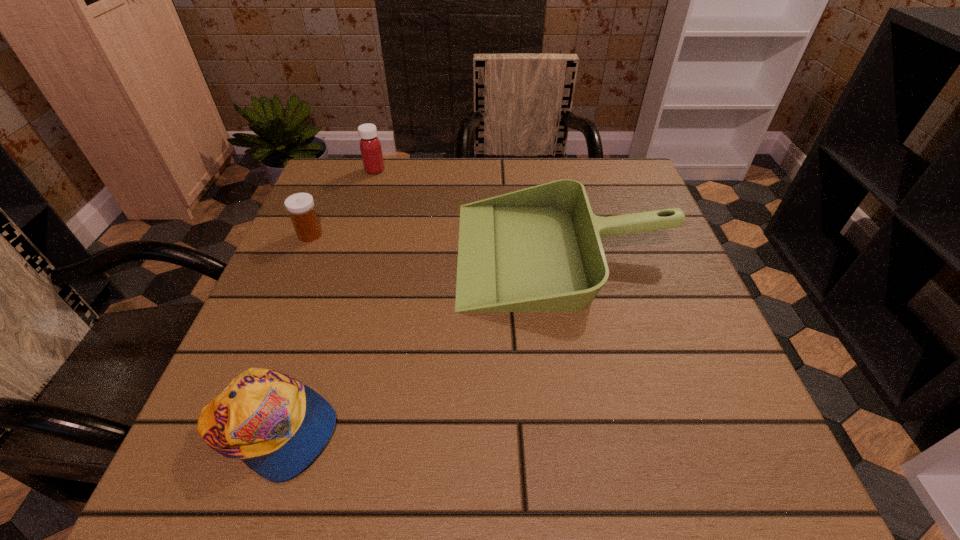
At what (x,y) coordinates should I click in order to perform the action: click on vacant space located 0.210m on the back of the shorter medicine. Please return your answer as a coordinate pair (x, y). Image resolution: width=960 pixels, height=540 pixels. Looking at the image, I should click on (335, 176).

Find the location of a particular element. The height and width of the screenshot is (540, 960). free point located on the bill of the nearest object is located at coordinates (610, 429).

In order to click on medicine located in the far edge section of the desktop in this screenshot , I will do `click(370, 146)`.

Locate an element on the screen. This screenshot has width=960, height=540. dustpan at the far edge is located at coordinates (539, 249).

What are the coordinates of `object that is at the near edge` in the screenshot? It's located at (276, 425).

Locate an element on the screen. The height and width of the screenshot is (540, 960). cap that is at the left edge is located at coordinates (276, 425).

The height and width of the screenshot is (540, 960). What are the coordinates of `object that is at the right edge` in the screenshot? It's located at (539, 249).

You are a GUI agent. You are given a task and a screenshot of the screen. Output one action in this format:
    pyautogui.click(x=<x>, y=<y>)
    Task: Click on the object at the far left corner
    Image resolution: width=960 pixels, height=540 pixels.
    Given the screenshot: What is the action you would take?
    pyautogui.click(x=370, y=146)

Identify the location of object located at the near left corner. (276, 425).

I want to click on object at the far right corner, so pyautogui.click(x=539, y=249).